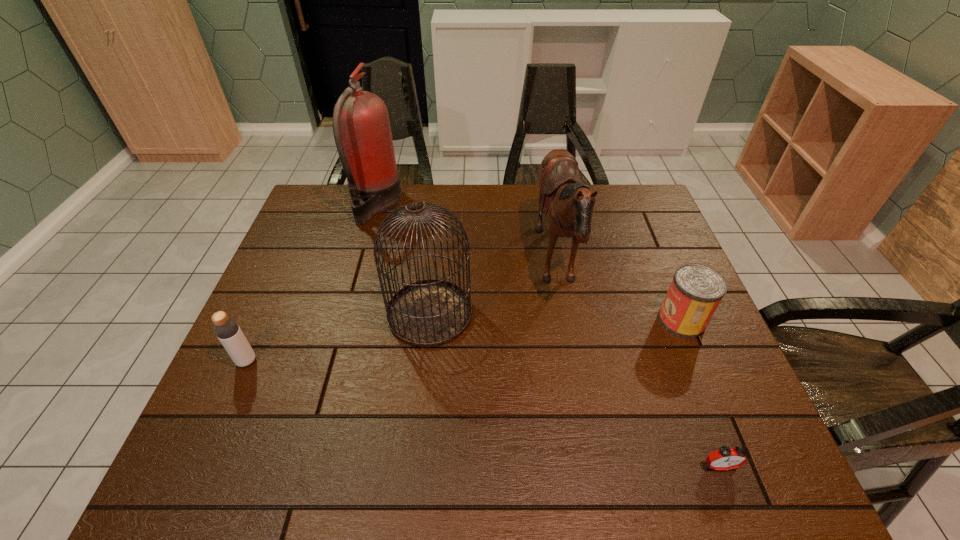
You are a GUI agent. You are given a task and a screenshot of the screen. Output one action in this format:
    pyautogui.click(x=<x>, y=<y>)
    Task: Click on the vacant space at the near right corner of the desktop
    This screenshot has width=960, height=540.
    Given the screenshot: What is the action you would take?
    pyautogui.click(x=758, y=440)

This screenshot has height=540, width=960. I want to click on vacant space that's between the can and the saddle, so click(619, 293).

This screenshot has height=540, width=960. I want to click on free space between the can and the fifth object from right to left, so click(529, 262).

Where is `free point between the saddle and the alarm clock`? The width and height of the screenshot is (960, 540). free point between the saddle and the alarm clock is located at coordinates (637, 366).

This screenshot has width=960, height=540. What are the coordinates of `empty location between the fourth object from left to right and the fourth object from right to left` in the screenshot? It's located at (493, 290).

Identify the location of free space between the can and the third object from right to left. This screenshot has height=540, width=960. (619, 293).

Find the location of `free spot between the can and the third object from right to left`. free spot between the can and the third object from right to left is located at coordinates (619, 293).

This screenshot has width=960, height=540. In order to click on free space between the leftmost object and the can in this screenshot , I will do `click(464, 341)`.

Where is `object that is the closest to the leftmost object`? The height and width of the screenshot is (540, 960). object that is the closest to the leftmost object is located at coordinates (427, 313).

The height and width of the screenshot is (540, 960). In order to click on object that stands as the second closest to the saddle in this screenshot , I will do (x=427, y=313).